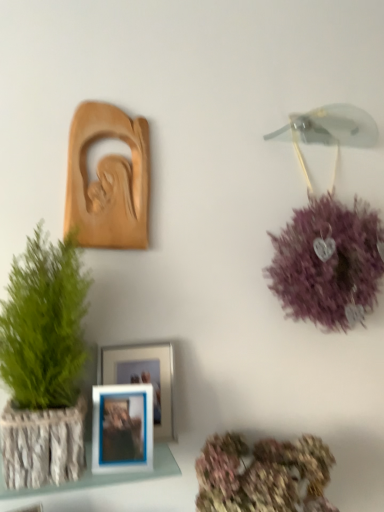
Question: Is the depth of pastel floral bouquet at lower center less than that of white textured frame at lower left?

Choices:
 (A) yes
 (B) no

Answer: (A)

Question: Considering the relative sizes of pastel floral bouquet at lower center and white textured frame at lower left in the image provided, is pastel floral bouquet at lower center thinner than white textured frame at lower left?

Choices:
 (A) no
 (B) yes

Answer: (A)

Question: Does pastel floral bouquet at lower center appear on the left side of white textured frame at lower left?

Choices:
 (A) no
 (B) yes

Answer: (A)

Question: From a real-world perspective, does pastel floral bouquet at lower center sit lower than white textured frame at lower left?

Choices:
 (A) no
 (B) yes

Answer: (B)

Question: Does pastel floral bouquet at lower center lie behind white textured frame at lower left?

Choices:
 (A) yes
 (B) no

Answer: (B)

Question: Is blue plastic picture frame at center, which is counted as the second picture frame, starting from the bottom, inside the boundaries of pastel floral bouquet at lower center, or outside?

Choices:
 (A) outside
 (B) inside

Answer: (A)

Question: From the image's perspective, is blue plastic picture frame at center, acting as the 2th picture frame starting from the top, located above or below pastel floral bouquet at lower center?

Choices:
 (A) below
 (B) above

Answer: (B)

Question: Is blue plastic picture frame at center, which is counted as the second picture frame, starting from the bottom, in front of or behind pastel floral bouquet at lower center in the image?

Choices:
 (A) behind
 (B) front

Answer: (A)

Question: From a real-world perspective, is blue plastic picture frame at center, which is counted as the second picture frame, starting from the bottom, above or below pastel floral bouquet at lower center?

Choices:
 (A) above
 (B) below

Answer: (A)

Question: Would you say blue plastic picture frame at center, the third picture frame in the top-to-bottom sequence, is inside or outside matte wood carving at upper left, the third picture frame when ordered from bottom to top?

Choices:
 (A) inside
 (B) outside

Answer: (B)

Question: In terms of width, does blue plastic picture frame at center, placed as the first picture frame when sorted from bottom to top, look wider or thinner when compared to matte wood carving at upper left, the third picture frame when ordered from bottom to top?

Choices:
 (A) thin
 (B) wide

Answer: (B)

Question: Based on their sizes in the image, would you say blue plastic picture frame at center, placed as the first picture frame when sorted from bottom to top, is bigger or smaller than matte wood carving at upper left, the third picture frame when ordered from bottom to top?

Choices:
 (A) big
 (B) small

Answer: (B)

Question: In the image, is blue plastic picture frame at center, the third picture frame in the top-to-bottom sequence, on the left side or the right side of matte wood carving at upper left, the third picture frame when ordered from bottom to top?

Choices:
 (A) right
 (B) left

Answer: (A)

Question: Considering their positions, is pastel floral bouquet at lower center located in front of or behind blue plastic picture frame at center, acting as the 2th picture frame starting from the top?

Choices:
 (A) front
 (B) behind

Answer: (A)

Question: Do you think pastel floral bouquet at lower center is within blue plastic picture frame at center, acting as the 2th picture frame starting from the top, or outside of it?

Choices:
 (A) outside
 (B) inside

Answer: (A)